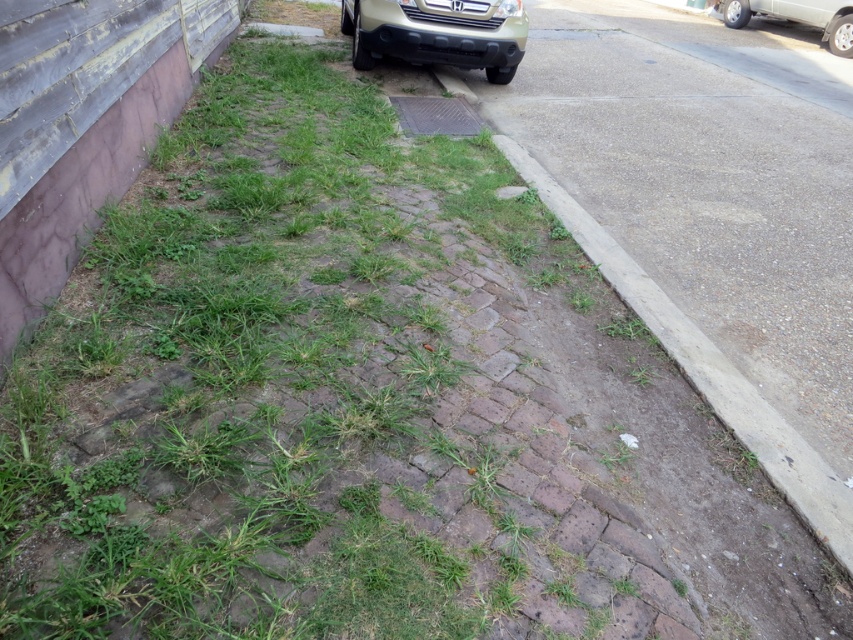
Question: Estimate the real-world distances between objects in this image. Which object is farther from the metallic grid cover at center?

Choices:
 (A) gold matte bumper at upper center
 (B) metallic gold suv at upper right

Answer: (B)

Question: Does metallic gold suv at upper right have a smaller size compared to metallic grid cover at center?

Choices:
 (A) yes
 (B) no

Answer: (B)

Question: Estimate the real-world distances between objects in this image. Which object is closer to the metallic grid cover at center?

Choices:
 (A) dull gray concrete at center
 (B) gold matte bumper at upper center

Answer: (B)

Question: Which point is farther from the camera taking this photo?

Choices:
 (A) [x=833, y=8]
 (B) [x=369, y=45]
 (C) [x=836, y=76]
 (D) [x=428, y=129]

Answer: (A)

Question: Does dull gray concrete at center have a greater width compared to metallic grid cover at center?

Choices:
 (A) no
 (B) yes

Answer: (B)

Question: Is gold matte bumper at upper center thinner than metallic grid cover at center?

Choices:
 (A) yes
 (B) no

Answer: (B)